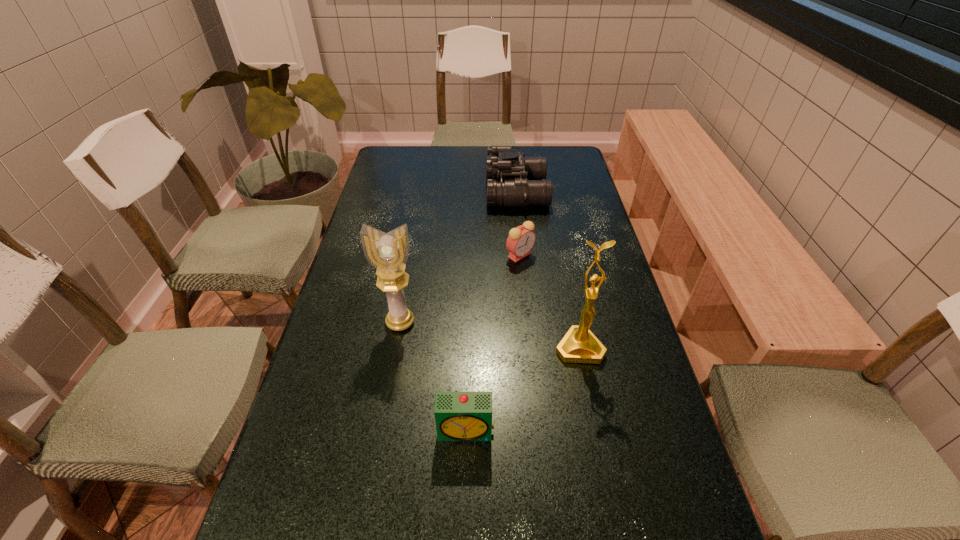
Where is `vacant space located 0.210m through the lenses of the farthest object`? The height and width of the screenshot is (540, 960). vacant space located 0.210m through the lenses of the farthest object is located at coordinates (428, 192).

You are a GUI agent. You are given a task and a screenshot of the screen. Output one action in this format:
    pyautogui.click(x=<x>, y=<y>)
    Task: Click on the free space located 0.250m through the lenses of the farthest object
    
    Given the screenshot: What is the action you would take?
    pyautogui.click(x=418, y=192)

At what (x,y) coordinates should I click in order to perform the action: click on free space located through the lenses of the farthest object. Please return your answer as a coordinate pair (x, y). The height and width of the screenshot is (540, 960). Looking at the image, I should click on (398, 192).

Where is `free space located 0.160m on the front-facing side of the nearer alarm clock`? free space located 0.160m on the front-facing side of the nearer alarm clock is located at coordinates (464, 528).

Identify the location of free space located 0.260m on the face of the fourth nearest object. This screenshot has height=540, width=960. (528, 332).

Where is `object at the far edge`? object at the far edge is located at coordinates (513, 180).

Where is `object that is positioned at the left edge`? The height and width of the screenshot is (540, 960). object that is positioned at the left edge is located at coordinates (388, 253).

At what (x,y) coordinates should I click in order to perform the action: click on award at the right edge. Please return your answer as a coordinate pair (x, y). The image size is (960, 540). Looking at the image, I should click on (579, 345).

I want to click on binoculars that is at the right edge, so click(513, 180).

What are the coordinates of `object present at the far right corner` in the screenshot? It's located at (513, 180).